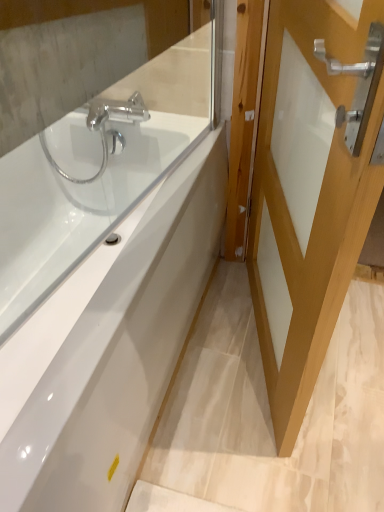
Question: In terms of height, does white glossy door at right look taller or shorter compared to clear glass mirror at upper left, acting as the first mirror starting from the back?

Choices:
 (A) short
 (B) tall

Answer: (B)

Question: From a real-world perspective, relative to clear glass mirror at upper left, acting as the first mirror starting from the back, is white glossy door at right vertically above or below?

Choices:
 (A) above
 (B) below

Answer: (B)

Question: Which object is the farthest from the clear glass mirror at upper left, the 2th mirror positioned from the front?

Choices:
 (A) clear glass mirror at upper left, arranged as the first mirror when viewed from the front
 (B) white glossy door at right
 (C) white glossy bathtub at center

Answer: (B)

Question: Which object is the closest to the white glossy door at right?

Choices:
 (A) clear glass mirror at upper left, arranged as the first mirror when viewed from the front
 (B) white glossy bathtub at center
 (C) clear glass mirror at upper left, acting as the first mirror starting from the back

Answer: (B)